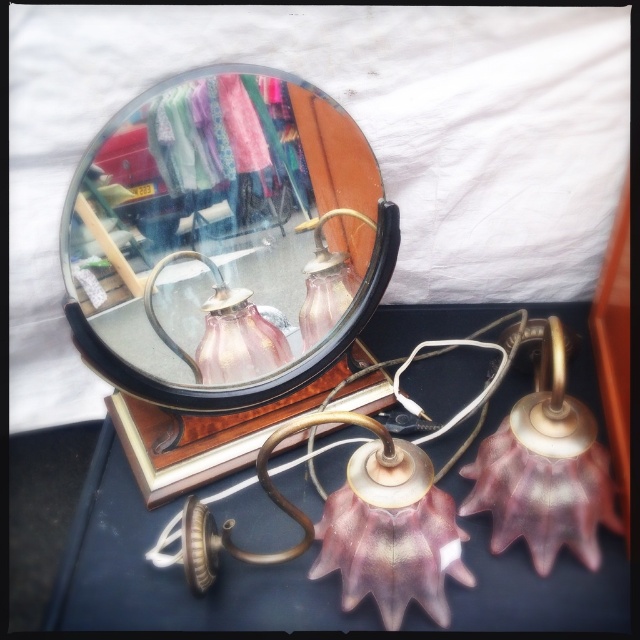
You are standing in front of the vintage mirror and want to locate the pink glass lamp at center. According to the coordinates provided, where exactly should you look on the mirror?

The pink glass lamp at center is located at coordinates point (180, 576) on the mirror.

You are standing in front of the vintage mirror and notice the pink glass lamp at center. Based on its position, can you determine if it is placed to the left or right of the mirror?

The pink glass lamp at center is located at point 0.900 on the x and 0.284 on the y, which places it to the right side of the mirror.

You are standing in front of the vintage mirror and notice a point marked at coordinate (180, 576). What object is located at this coordinate?

The point at coordinate (180, 576) marks the location of the pink glass lamp at center.